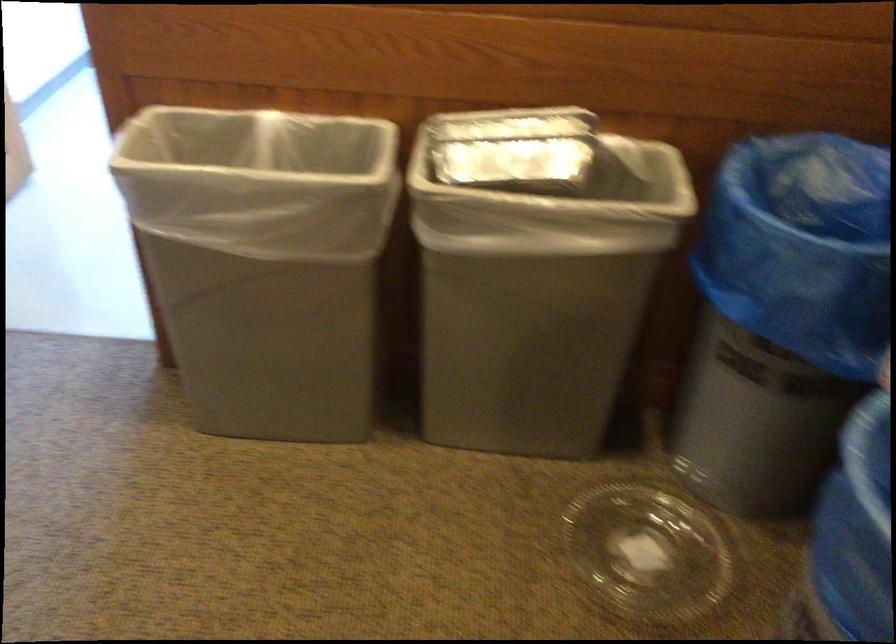
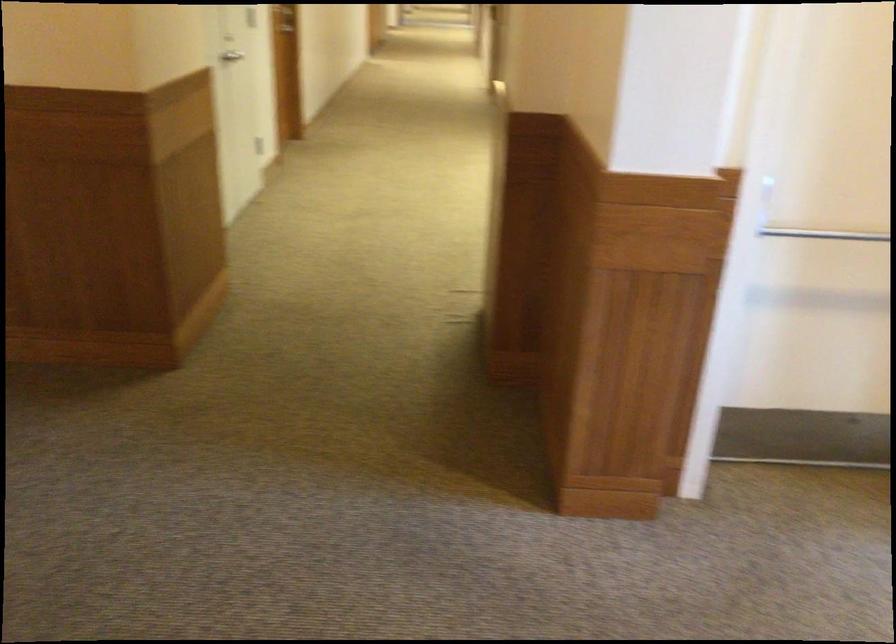
The images are taken continuously from a first-person perspective. In which direction is your viewpoint rotating?

The rotation direction of the camera is left-down.